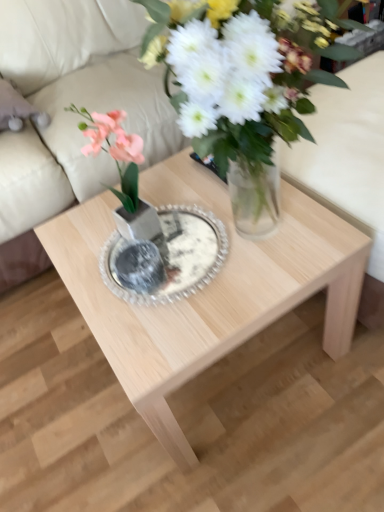
The height and width of the screenshot is (512, 384). I want to click on empty space that is ontop of natural wood coffee table at center (from a real-world perspective), so 193,239.